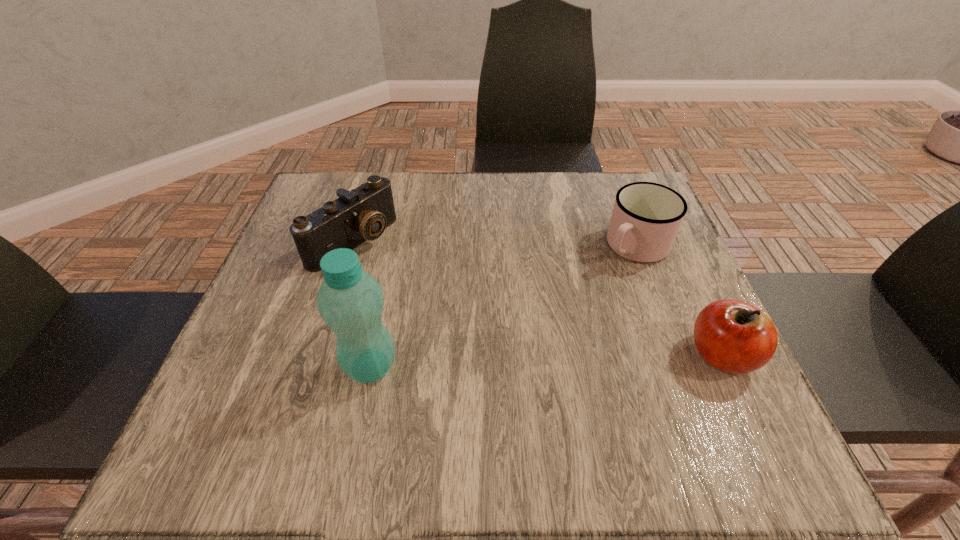
At what (x,y) coordinates should I click in order to perform the action: click on vacant space on the desktop that is between the tallest object and the apple and is positioned on the front-facing side of the camera. Please return your answer as a coordinate pair (x, y). Looking at the image, I should click on (536, 361).

Locate an element on the screen. free space on the desktop that is between the bottle and the apple and is positioned on the side of the mug with the handle is located at coordinates (506, 362).